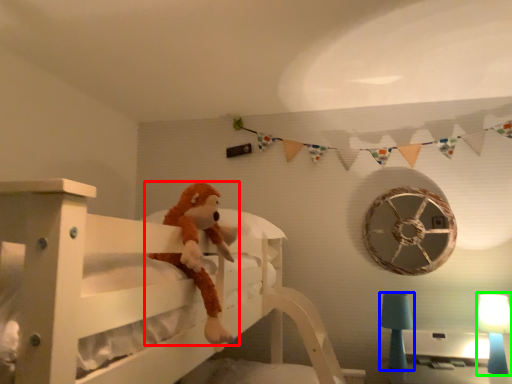
Question: Which object is the farthest from toy (highlighted by a red box)? Choose among these: table lamp (highlighted by a blue box) or table lamp (highlighted by a green box).

Choices:
 (A) table lamp
 (B) table lamp

Answer: (B)